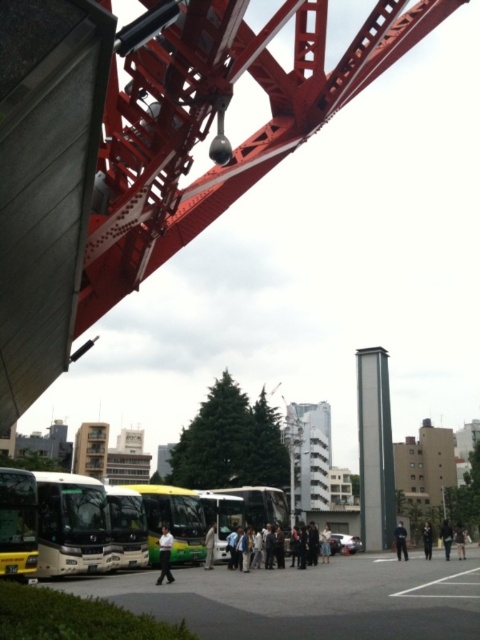
Please look at the image and locate the point at coordinates (274, 547). What object is located at that point?

The point at coordinates (274, 547) marks the location of the dark gray suit at center.

You are standing in the urban scene and want to walk from point A to point B. Point A is at coordinates point (247, 541) and point B is at point (206, 552). Which direction should you move to get closer to point B?

To move from point A at coordinates point (247, 541) to point B at point (206, 552), you should move towards the upper right direction since point B is located in that direction relative to point A.

You are a photographer standing in front of the large red crane structure. You notice two people wearing a dark gray suit at center and a light brown leather jacket at center. Which person is standing to the right of the other?

The dark gray suit at center is positioned on the right side of light brown leather jacket at center.